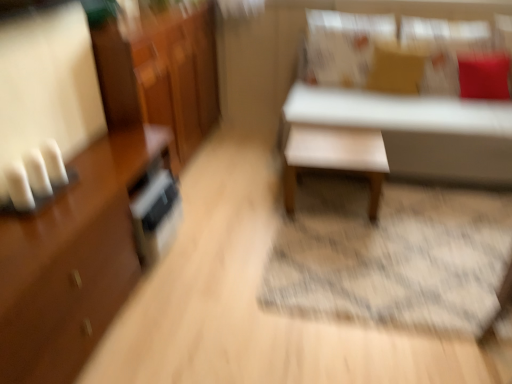
Question: Is shiny brown dresser at left surrounding brown glossy cabinet at left?

Choices:
 (A) no
 (B) yes

Answer: (A)

Question: From the image's perspective, does shiny brown dresser at left appear lower than brown glossy cabinet at left?

Choices:
 (A) no
 (B) yes

Answer: (A)

Question: Is shiny brown dresser at left positioned behind brown glossy cabinet at left?

Choices:
 (A) no
 (B) yes

Answer: (B)

Question: Considering the relative positions of shiny brown dresser at left and brown glossy cabinet at left in the image provided, is shiny brown dresser at left to the right of brown glossy cabinet at left from the viewer's perspective?

Choices:
 (A) yes
 (B) no

Answer: (A)

Question: From the image's perspective, would you say shiny brown dresser at left is positioned over brown glossy cabinet at left?

Choices:
 (A) no
 (B) yes

Answer: (B)

Question: From a real-world perspective, relative to white matte bench at upper right, arranged as the 2th table when viewed from the left, is brown glossy cabinet at left vertically above or below?

Choices:
 (A) below
 (B) above

Answer: (A)

Question: In the image, is brown glossy cabinet at left positioned in front of or behind white matte bench at upper right, arranged as the 2th table when viewed from the left?

Choices:
 (A) behind
 (B) front

Answer: (B)

Question: From their relative heights in the image, would you say brown glossy cabinet at left is taller or shorter than white matte bench at upper right, acting as the first table starting from the right?

Choices:
 (A) tall
 (B) short

Answer: (B)

Question: Is brown glossy cabinet at left inside the boundaries of white matte bench at upper right, acting as the first table starting from the right, or outside?

Choices:
 (A) outside
 (B) inside

Answer: (A)

Question: In terms of size, does matte brown pillow at upper center, the second pillow viewed from the left, appear bigger or smaller than brown glossy cabinet at left?

Choices:
 (A) small
 (B) big

Answer: (A)

Question: Considering the positions of matte brown pillow at upper center, the second pillow from the right, and brown glossy cabinet at left in the image, is matte brown pillow at upper center, the second pillow from the right, taller or shorter than brown glossy cabinet at left?

Choices:
 (A) tall
 (B) short

Answer: (B)

Question: From the image's perspective, is matte brown pillow at upper center, the second pillow from the right, located above or below brown glossy cabinet at left?

Choices:
 (A) below
 (B) above

Answer: (B)

Question: In terms of width, does matte brown pillow at upper center, the second pillow viewed from the left, look wider or thinner when compared to brown glossy cabinet at left?

Choices:
 (A) thin
 (B) wide

Answer: (A)

Question: Does point (375, 59) appear closer or farther from the camera than point (174, 49)?

Choices:
 (A) closer
 (B) farther

Answer: (B)

Question: Considering the positions of matte brown pillow at upper center, the second pillow viewed from the left, and shiny brown dresser at left in the image, is matte brown pillow at upper center, the second pillow viewed from the left, taller or shorter than shiny brown dresser at left?

Choices:
 (A) tall
 (B) short

Answer: (B)